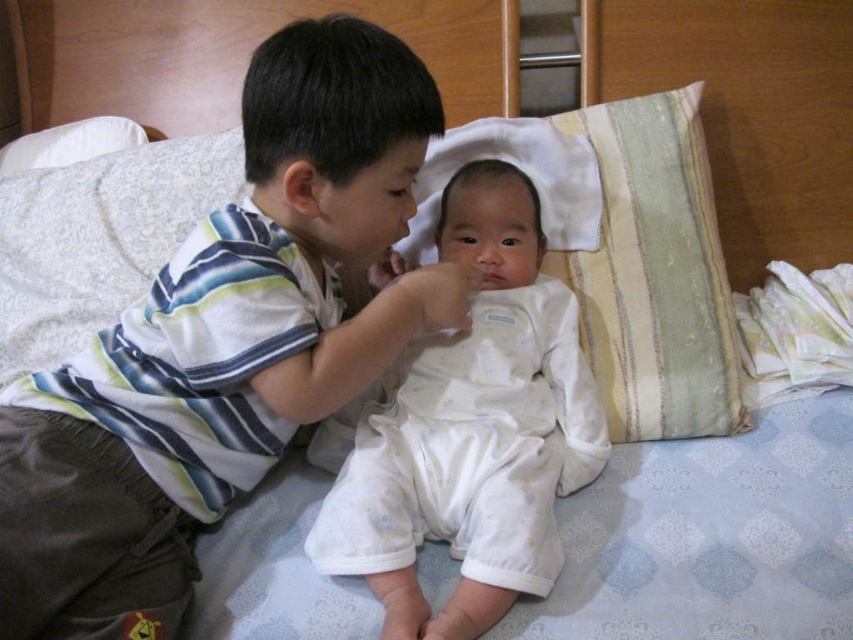
Question: Does striped cotton shirt at center lie behind green striped pillow at upper right?

Choices:
 (A) no
 (B) yes

Answer: (A)

Question: Which of the following is the farthest from the observer?

Choices:
 (A) (550, 326)
 (B) (732, 420)
 (C) (287, 280)

Answer: (B)

Question: In this image, where is white textured pillow at upper center located relative to white cotton baby at center?

Choices:
 (A) right
 (B) left

Answer: (A)

Question: Does white cotton baby at center appear on the left side of green striped pillow at upper right?

Choices:
 (A) yes
 (B) no

Answer: (A)

Question: Which point is closer to the camera?

Choices:
 (A) white cotton baby at center
 (B) white textured pillow at upper center

Answer: (A)

Question: Considering the real-world distances, which object is closest to the green striped pillow at upper right?

Choices:
 (A) striped cotton shirt at center
 (B) white cotton baby at center
 (C) white textured pillow at upper center

Answer: (C)